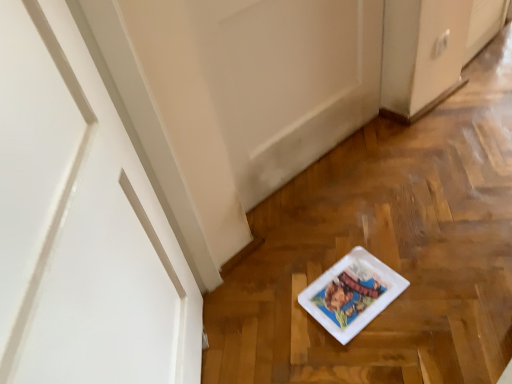
Where is `blank space situated above white glossy platter at center (from a real-world perspective)`? Image resolution: width=512 pixels, height=384 pixels. blank space situated above white glossy platter at center (from a real-world perspective) is located at coordinates (350, 282).